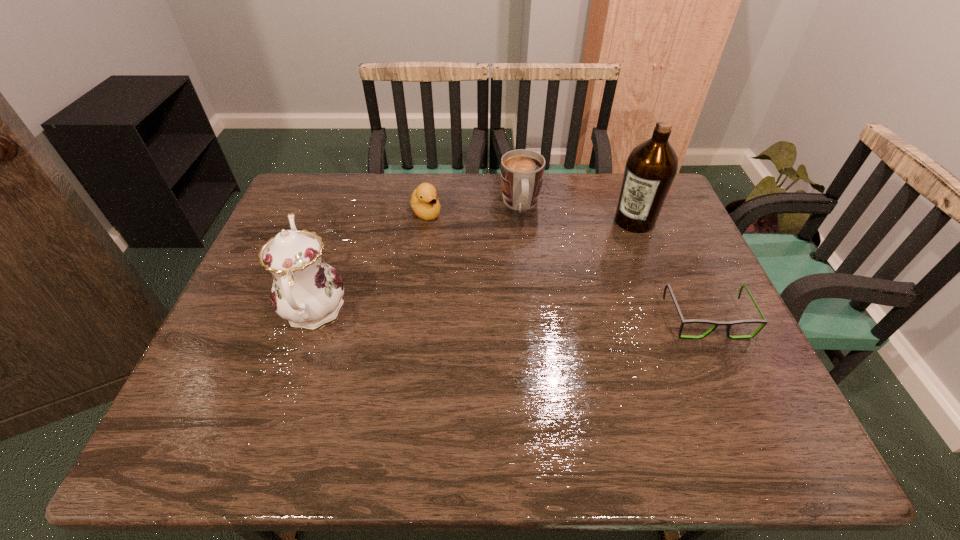
At what (x,y) coordinates should I click in order to perform the action: click on the leftmost object. Please return your answer as a coordinate pair (x, y). The image size is (960, 540). Looking at the image, I should click on (306, 291).

I want to click on the fourth shortest object, so click(x=306, y=291).

Find the location of a particular element. Image resolution: width=960 pixels, height=540 pixels. spectacles is located at coordinates (728, 324).

I want to click on the second object from left to right, so click(x=426, y=206).

You are a GUI agent. You are given a task and a screenshot of the screen. Output one action in this format:
    pyautogui.click(x=<x>, y=<y>)
    Task: Click on the duckling
    This screenshot has width=960, height=540.
    Given the screenshot: What is the action you would take?
    pyautogui.click(x=426, y=206)

What are the coordinates of `olive oil` in the screenshot? It's located at (651, 167).

Locate an element on the screen. the third tallest object is located at coordinates (522, 171).

You are a GUI agent. You are given a task and a screenshot of the screen. Output one action in this format:
    pyautogui.click(x=<x>, y=<y>)
    Task: Click on the mug
    The image size is (960, 540).
    Given the screenshot: What is the action you would take?
    pyautogui.click(x=522, y=171)

Image resolution: width=960 pixels, height=540 pixels. Identify the location of vacant space located 0.380m on the back of the chinaware. (354, 192).

What are the coordinates of `free space located 0.150m on the lens of the shortest object` in the screenshot? It's located at (741, 397).